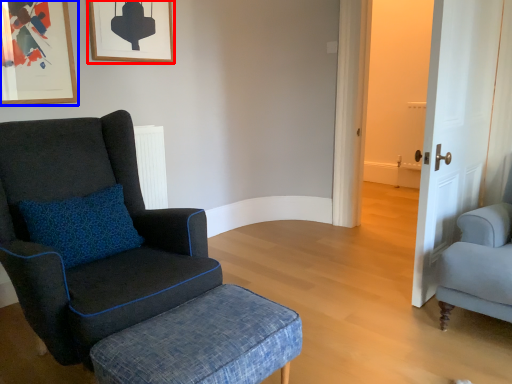
Question: Which object appears farthest to the camera in this image, picture frame (highlighted by a red box) or picture frame (highlighted by a blue box)?

Choices:
 (A) picture frame
 (B) picture frame

Answer: (A)